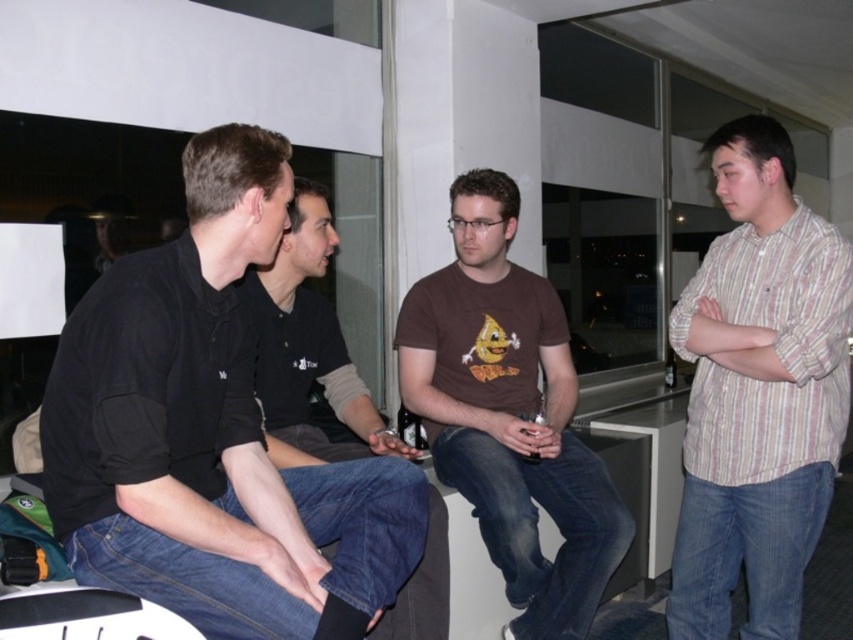
Does brown cotton t-shirt at center have a greater height compared to black matte shirt at center?

Yes.

Does point (622, 502) lie in front of point (289, 384)?

No, it is behind (289, 384).

Locate an element on the screen. The height and width of the screenshot is (640, 853). brown cotton t-shirt at center is located at coordinates (509, 413).

Does point (735, 252) lie behind point (553, 404)?

No, it is in front of (553, 404).

Is striped cotton shirt at right shorter than brown cotton t-shirt at center?

Yes.

Is point (733, 228) closer to camera compared to point (474, 467)?

That is False.

Locate an element on the screen. This screenshot has width=853, height=640. striped cotton shirt at right is located at coordinates (758, 392).

Who is more forward, (225, 308) or (273, 454)?

Point (225, 308)

Is black matte shirt at left to the right of black matte shirt at center from the viewer's perspective?

No, black matte shirt at left is not to the right of black matte shirt at center.

Does point (368, 499) lie behind point (358, 419)?

No, it is not.

This screenshot has width=853, height=640. Find the location of `black matte shirt at left`. black matte shirt at left is located at coordinates (212, 435).